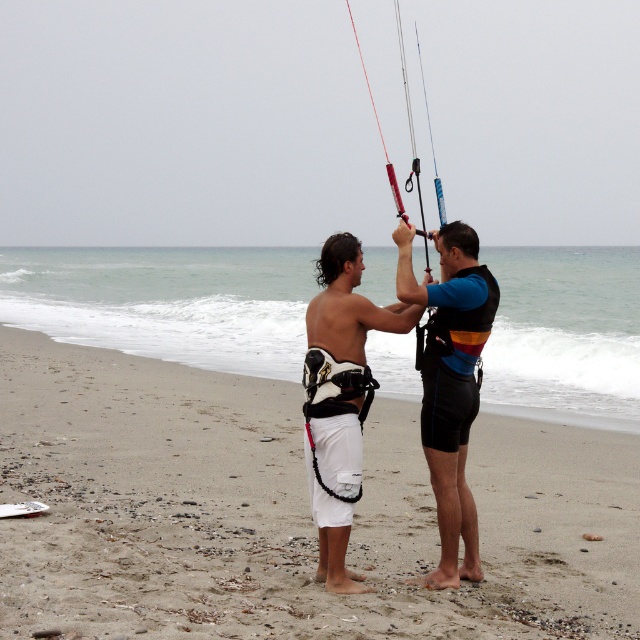
Which is behind, point (99, 442) or point (426, 420)?

The point (99, 442) is behind.

The height and width of the screenshot is (640, 640). Find the location of `white sand at center`. white sand at center is located at coordinates (285, 512).

Is white sand at center to the right of white matte shorts at center from the viewer's perspective?

Incorrect, white sand at center is not on the right side of white matte shorts at center.

Does point (138, 528) come farther from viewer compared to point (376, 323)?

Yes.

This screenshot has height=640, width=640. In order to click on white sand at center in this screenshot , I will do `click(285, 512)`.

This screenshot has height=640, width=640. In order to click on white sand at center in this screenshot , I will do `click(285, 512)`.

Does black neoprene wetsuit at center appear under white matte shorts at center?

No, black neoprene wetsuit at center is not below white matte shorts at center.

Between black neoprene wetsuit at center and white matte shorts at center, which one appears on the left side from the viewer's perspective?

white matte shorts at center is more to the left.

Describe the element at coordinates (451, 385) in the screenshot. The width and height of the screenshot is (640, 640). I see `black neoprene wetsuit at center` at that location.

In order to click on black neoprene wetsuit at center in this screenshot , I will do `click(451, 385)`.